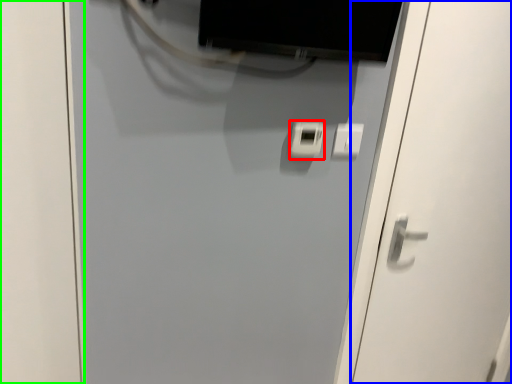
Question: Which object is the farthest from light switch (highlighted by a red box)? Choose among these: door (highlighted by a blue box) or door (highlighted by a green box).

Choices:
 (A) door
 (B) door

Answer: (B)